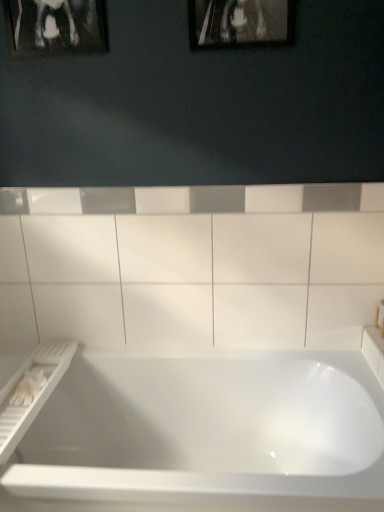
This screenshot has width=384, height=512. What do you see at coordinates (240, 23) in the screenshot?
I see `metallic silver picture frame at upper center, the 1th picture frame from the right` at bounding box center [240, 23].

Identify the location of black glossy picture frame at upper left, acting as the second picture frame starting from the right. This screenshot has width=384, height=512. (56, 27).

What are the coordinates of `bathtub in front of the white glossy ceramic tile at center` in the screenshot? It's located at (207, 433).

Considering the relative sizes of white glossy ceramic tile at center and white glossy bathtub at center in the image provided, is white glossy ceramic tile at center shorter than white glossy bathtub at center?

Incorrect, the height of white glossy ceramic tile at center does not fall short of that of white glossy bathtub at center.

From a real-world perspective, who is located lower, white glossy ceramic tile at center or black glossy picture frame at upper left, acting as the second picture frame starting from the right?

In real-world perspective, white glossy ceramic tile at center is lower.

Is white glossy ceramic tile at center far from black glossy picture frame at upper left, acting as the second picture frame starting from the right?

They are positioned close to each other.

Considering the sizes of objects metallic silver picture frame at upper center, the 1th picture frame from the right, and black glossy picture frame at upper left, the first picture frame positioned from the left, in the image provided, who is shorter, metallic silver picture frame at upper center, the 1th picture frame from the right, or black glossy picture frame at upper left, the first picture frame positioned from the left,?

black glossy picture frame at upper left, the first picture frame positioned from the left, is shorter.

Is metallic silver picture frame at upper center, the 1th picture frame from the right, far from black glossy picture frame at upper left, the first picture frame positioned from the left?

metallic silver picture frame at upper center, the 1th picture frame from the right, is near black glossy picture frame at upper left, the first picture frame positioned from the left, not far away.

Which object is further away from the camera taking this photo, metallic silver picture frame at upper center, the 1th picture frame from the right, or black glossy picture frame at upper left, the first picture frame positioned from the left?

black glossy picture frame at upper left, the first picture frame positioned from the left, is more distant.

Which point is more forward, [205,40] or [50,36]?

The point [205,40] is more forward.

In terms of height, does black glossy picture frame at upper left, the first picture frame positioned from the left, look taller or shorter compared to metallic silver picture frame at upper center, the 1th picture frame from the right?

In the image, black glossy picture frame at upper left, the first picture frame positioned from the left, appears to be shorter than metallic silver picture frame at upper center, the 1th picture frame from the right.

From the image's perspective, is black glossy picture frame at upper left, acting as the second picture frame starting from the right, above or below metallic silver picture frame at upper center, the 1th picture frame from the right?

black glossy picture frame at upper left, acting as the second picture frame starting from the right, is above metallic silver picture frame at upper center, the 1th picture frame from the right.

Is black glossy picture frame at upper left, the first picture frame positioned from the left, completely or partially outside of metallic silver picture frame at upper center, the 2th picture frame in the left-to-right sequence?

Indeed, black glossy picture frame at upper left, the first picture frame positioned from the left, is completely outside metallic silver picture frame at upper center, the 2th picture frame in the left-to-right sequence.

Based on the photo, are metallic silver picture frame at upper center, the 1th picture frame from the right, and white glossy ceramic tile at center making contact?

No, metallic silver picture frame at upper center, the 1th picture frame from the right, is not next to white glossy ceramic tile at center.

Would you say metallic silver picture frame at upper center, the 2th picture frame in the left-to-right sequence, is outside white glossy ceramic tile at center?

Yes, metallic silver picture frame at upper center, the 2th picture frame in the left-to-right sequence, is outside of white glossy ceramic tile at center.

Which is more to the right, metallic silver picture frame at upper center, the 1th picture frame from the right, or white glossy ceramic tile at center?

From the viewer's perspective, metallic silver picture frame at upper center, the 1th picture frame from the right, appears more on the right side.

Locate an element on the screen. The width and height of the screenshot is (384, 512). the 1st picture frame above the white glossy ceramic tile at center (from a real-world perspective) is located at coordinates (240, 23).

Is black glossy picture frame at upper left, acting as the second picture frame starting from the right, turned away from white glossy bathtub at center?

No, black glossy picture frame at upper left, acting as the second picture frame starting from the right, is not facing away from white glossy bathtub at center.

Between black glossy picture frame at upper left, the first picture frame positioned from the left, and white glossy bathtub at center, which one is positioned behind?

black glossy picture frame at upper left, the first picture frame positioned from the left, is more distant.

From the image's perspective, does black glossy picture frame at upper left, acting as the second picture frame starting from the right, appear lower than white glossy bathtub at center?

No, from the image's perspective, black glossy picture frame at upper left, acting as the second picture frame starting from the right, is not below white glossy bathtub at center.

Is point (294, 494) closer or farther from the camera than point (370, 304)?

Point (294, 494) appears to be closer to the viewer than point (370, 304).

Is white glossy bathtub at center directly adjacent to white glossy ceramic tile at center?

No, white glossy bathtub at center is not making contact with white glossy ceramic tile at center.

From a real-world perspective, between white glossy bathtub at center and white glossy ceramic tile at center, who is vertically higher?

From a 3D spatial view, white glossy ceramic tile at center is above.

Can we say white glossy bathtub at center lies outside white glossy ceramic tile at center?

Yes, white glossy bathtub at center is located beyond the bounds of white glossy ceramic tile at center.

Find the location of a particular element. Image resolution: width=384 pixels, height=512 pixels. ceramic tile above the white glossy bathtub at center (from a real-world perspective) is located at coordinates (193, 268).

This screenshot has width=384, height=512. Find the location of `the 1st picture frame in front of the white glossy ceramic tile at center`. the 1st picture frame in front of the white glossy ceramic tile at center is located at coordinates (56, 27).

Considering their positions, is white glossy bathtub at center positioned further to white glossy ceramic tile at center than metallic silver picture frame at upper center, the 1th picture frame from the right?

Based on the image, metallic silver picture frame at upper center, the 1th picture frame from the right, appears to be further to white glossy ceramic tile at center.

Considering their positions, is metallic silver picture frame at upper center, the 1th picture frame from the right, positioned further to white glossy bathtub at center than black glossy picture frame at upper left, the first picture frame positioned from the left?

The object further to white glossy bathtub at center is black glossy picture frame at upper left, the first picture frame positioned from the left.

Considering their positions, is black glossy picture frame at upper left, the first picture frame positioned from the left, positioned further to white glossy ceramic tile at center than metallic silver picture frame at upper center, the 1th picture frame from the right?

black glossy picture frame at upper left, the first picture frame positioned from the left, lies further to white glossy ceramic tile at center than the other object.

Considering their positions, is white glossy ceramic tile at center positioned closer to metallic silver picture frame at upper center, the 1th picture frame from the right, than black glossy picture frame at upper left, acting as the second picture frame starting from the right?

black glossy picture frame at upper left, acting as the second picture frame starting from the right, is closer to metallic silver picture frame at upper center, the 1th picture frame from the right.

When comparing their distances from white glossy ceramic tile at center, does metallic silver picture frame at upper center, the 1th picture frame from the right, or white glossy bathtub at center seem closer?

white glossy bathtub at center lies closer to white glossy ceramic tile at center than the other object.

Estimate the real-world distances between objects in this image. Which object is closer to black glossy picture frame at upper left, the first picture frame positioned from the left, white glossy bathtub at center or white glossy ceramic tile at center?

Among the two, white glossy ceramic tile at center is located nearer to black glossy picture frame at upper left, the first picture frame positioned from the left.

Considering their positions, is black glossy picture frame at upper left, the first picture frame positioned from the left, positioned closer to metallic silver picture frame at upper center, the 2th picture frame in the left-to-right sequence, than white glossy bathtub at center?

Among the two, black glossy picture frame at upper left, the first picture frame positioned from the left, is located nearer to metallic silver picture frame at upper center, the 2th picture frame in the left-to-right sequence.

Which object lies further to the anchor point black glossy picture frame at upper left, acting as the second picture frame starting from the right, white glossy bathtub at center or metallic silver picture frame at upper center, the 1th picture frame from the right?

white glossy bathtub at center is positioned further to the anchor black glossy picture frame at upper left, acting as the second picture frame starting from the right.

Find the location of `ceramic tile that lies between black glossy picture frame at upper left, acting as the second picture frame starting from the right, and white glossy bathtub at center from top to bottom`. ceramic tile that lies between black glossy picture frame at upper left, acting as the second picture frame starting from the right, and white glossy bathtub at center from top to bottom is located at coordinates (193, 268).

Find the location of a particular element. Image resolution: width=384 pixels, height=512 pixels. ceramic tile between metallic silver picture frame at upper center, the 2th picture frame in the left-to-right sequence, and white glossy bathtub at center from top to bottom is located at coordinates (193, 268).

Locate an element on the screen. The height and width of the screenshot is (512, 384). picture frame between black glossy picture frame at upper left, the first picture frame positioned from the left, and white glossy bathtub at center vertically is located at coordinates (240, 23).

Locate an element on the screen. The image size is (384, 512). picture frame that lies between black glossy picture frame at upper left, the first picture frame positioned from the left, and white glossy ceramic tile at center from top to bottom is located at coordinates (240, 23).